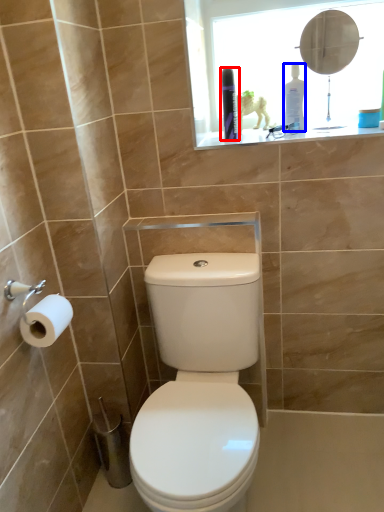
Question: Among these objects, which one is farthest to the camera, toiletry (highlighted by a red box) or toiletry (highlighted by a blue box)?

Choices:
 (A) toiletry
 (B) toiletry

Answer: (B)